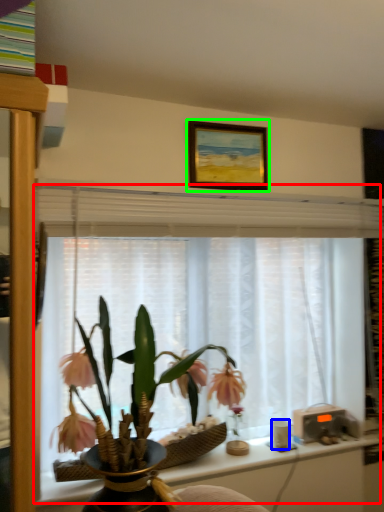
Question: Which is nearer to the window frame (highlighted by a red box)? coffee cup (highlighted by a blue box) or picture frame (highlighted by a green box).

Choices:
 (A) coffee cup
 (B) picture frame

Answer: (B)